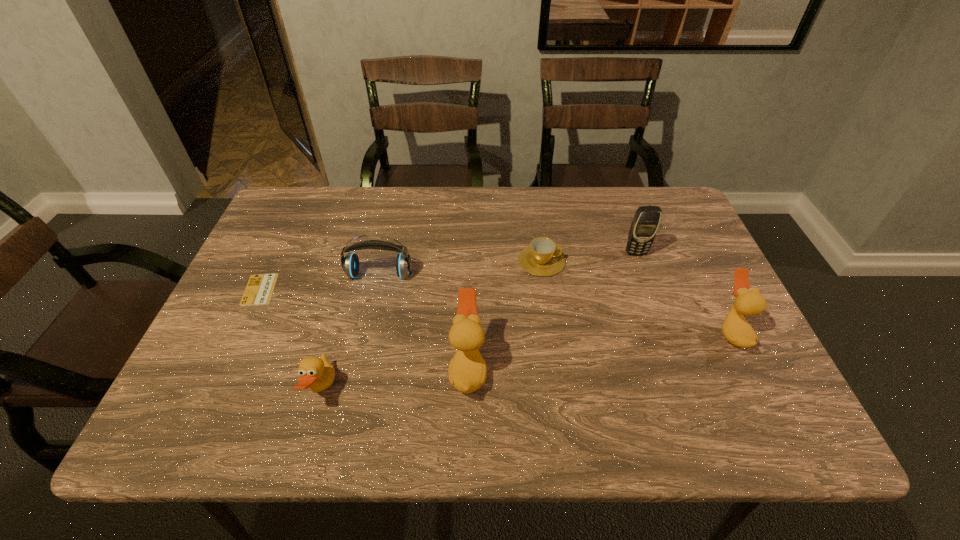
Find the location of `vacant area that lies between the second duck from left to right and the fifth object from left to right`. vacant area that lies between the second duck from left to right and the fifth object from left to right is located at coordinates pyautogui.click(x=505, y=315).

At what (x,y) coordinates should I click in order to perform the action: click on vacant area that lies between the tallest duck and the headset. Please return your answer as a coordinate pair (x, y). The height and width of the screenshot is (540, 960). Looking at the image, I should click on (423, 322).

Where is `vacant region between the cup and the second shortest duck`? Image resolution: width=960 pixels, height=540 pixels. vacant region between the cup and the second shortest duck is located at coordinates (636, 296).

Find the location of a particular element. empty space between the rightmost duck and the headset is located at coordinates (555, 303).

The image size is (960, 540). What are the coordinates of `free space between the headset and the leftmost duck` in the screenshot? It's located at point(350,332).

Where is `blank region between the fifth tallest object and the second shortest object`? blank region between the fifth tallest object and the second shortest object is located at coordinates (432, 325).

Where is `free spot between the second object from right to left and the tallest duck`? free spot between the second object from right to left and the tallest duck is located at coordinates (552, 311).

The image size is (960, 540). Find the location of `free space between the second duck from left to right and the headset`. free space between the second duck from left to right and the headset is located at coordinates (423, 322).

The width and height of the screenshot is (960, 540). In order to click on free spot between the cup and the cellular telephone in this screenshot , I will do `click(588, 257)`.

Where is `empty location between the rightmost duck and the sixth object from left to right`? This screenshot has height=540, width=960. empty location between the rightmost duck and the sixth object from left to right is located at coordinates (684, 293).